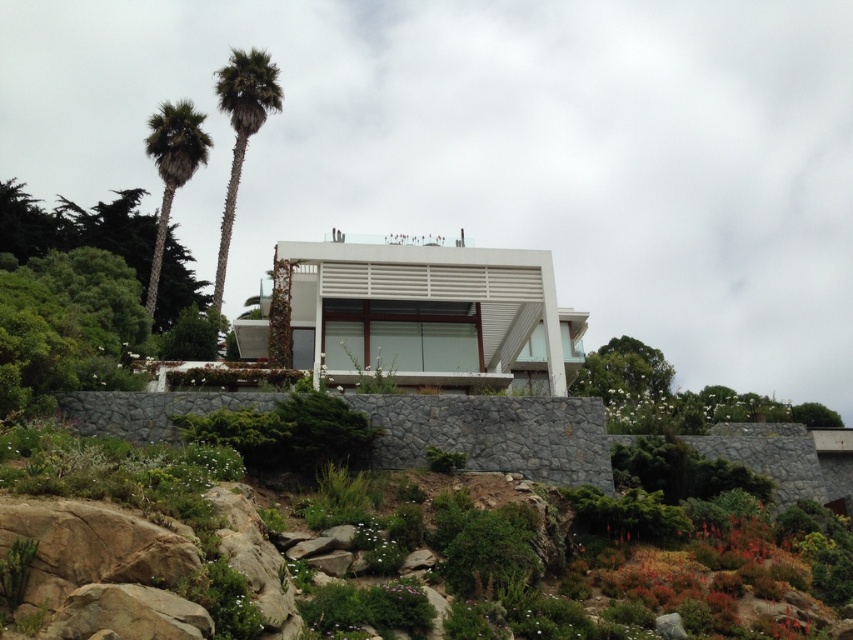
Please use the coordinate system where the bottom left corner is the origin. The image has a width of 1 unit and a height of 1 unit. The green leafy palm tree at upper left is located at which coordinate?

The green leafy palm tree at upper left is located at coordinate point (241, 134).

You are a landscape architect planning to install a new pathway between the green leafy palm tree at upper left and the green leafy palm tree at left. Based on their widths, which tree requires more space on either side of the pathway?

The green leafy palm tree at upper left might require more space on either side of the pathway since it is possibly wider than the green leafy palm tree at left.